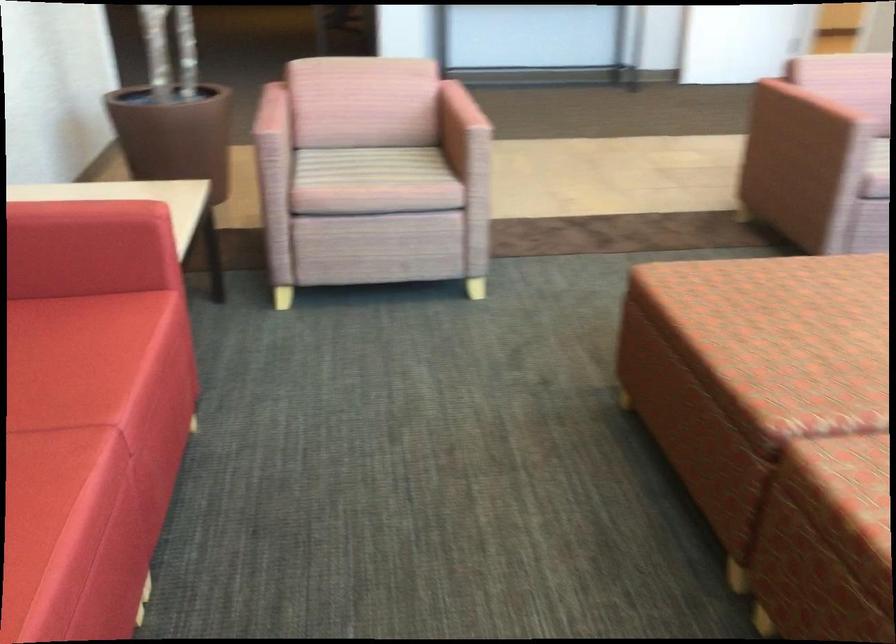
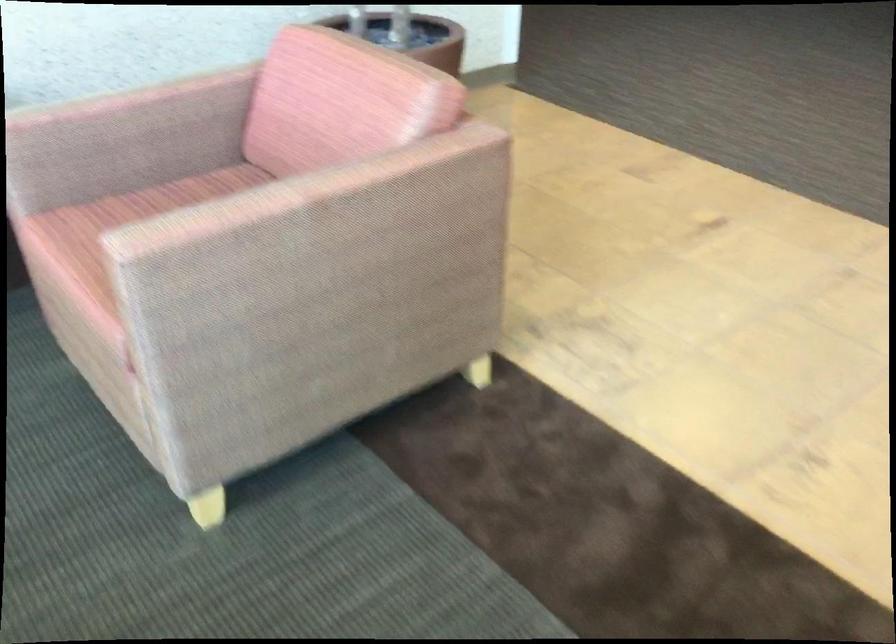
The point at [286,108] is marked in the first image. Where is the corresponding point in the second image?

(121, 98)